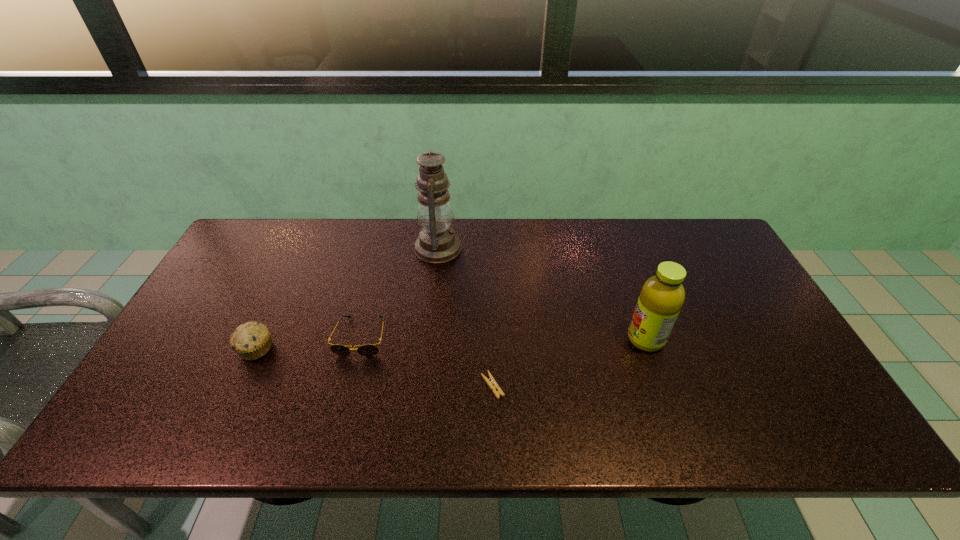
What are the coordinates of `oil lamp` in the screenshot? It's located at (437, 243).

Locate an element on the screen. This screenshot has width=960, height=540. the farthest object is located at coordinates (437, 243).

Locate an element on the screen. The image size is (960, 540). the rightmost object is located at coordinates (662, 296).

Find the location of a particular element. The height and width of the screenshot is (540, 960). the fourth shortest object is located at coordinates (662, 296).

This screenshot has height=540, width=960. I want to click on the third tallest object, so coord(252,340).

Locate an element on the screen. The width and height of the screenshot is (960, 540). the leftmost object is located at coordinates (252, 340).

Image resolution: width=960 pixels, height=540 pixels. Identify the location of the second object from left to right. (368, 349).

I want to click on the fourth tallest object, so click(x=368, y=349).

Image resolution: width=960 pixels, height=540 pixels. In order to click on the second object from right to left in this screenshot , I will do `click(491, 382)`.

At what (x,y) coordinates should I click in order to perform the action: click on the shortest object. Please return your answer as a coordinate pair (x, y). The image size is (960, 540). Looking at the image, I should click on (491, 382).